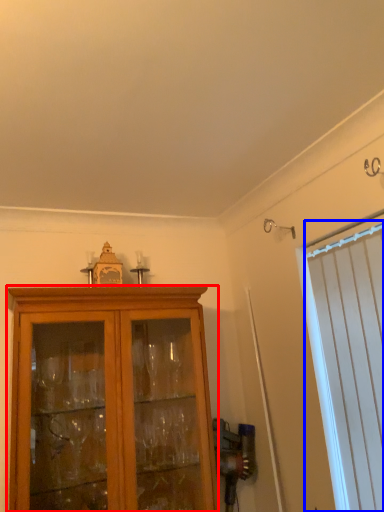
Question: Which of the following is the closest to the observer, cabinetry (highlighted by a red box) or curtain (highlighted by a blue box)?

Choices:
 (A) cabinetry
 (B) curtain

Answer: (B)